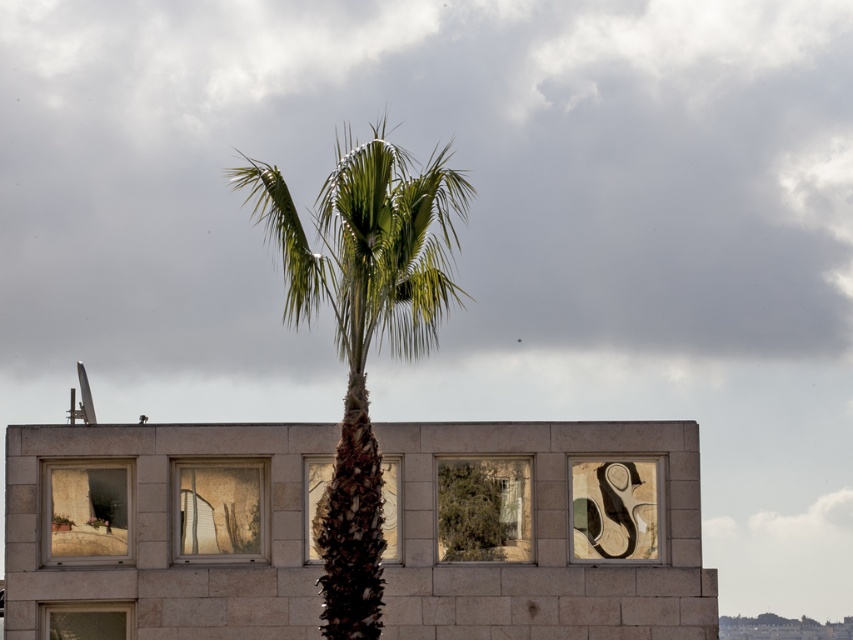
Question: Which object is farther from the camera taking this photo?

Choices:
 (A) green leafy tree at center
 (B) green leafy palm tree at center

Answer: (A)

Question: Can you confirm if green leafy palm tree at center is positioned to the left of green leafy tree at center?

Choices:
 (A) no
 (B) yes

Answer: (B)

Question: Which point is farther to the camera?

Choices:
 (A) (399, 308)
 (B) (440, 484)

Answer: (B)

Question: Which of the following is the farthest from the observer?

Choices:
 (A) green leafy tree at center
 (B) green leafy palm tree at center

Answer: (A)

Question: Is green leafy palm tree at center to the right of green leafy tree at center from the viewer's perspective?

Choices:
 (A) no
 (B) yes

Answer: (A)

Question: Can you confirm if green leafy palm tree at center is bigger than green leafy tree at center?

Choices:
 (A) no
 (B) yes

Answer: (B)